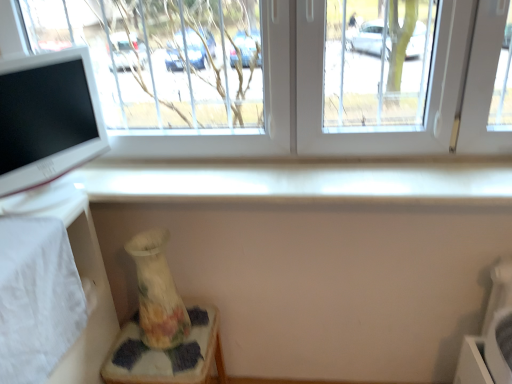
Question: Should I look upward or downward to see white glossy computer monitor at left?

Choices:
 (A) down
 (B) up

Answer: (B)

Question: Is white glossy computer monitor at left completely or partially inside white fabric table at lower left?

Choices:
 (A) yes
 (B) no

Answer: (B)

Question: Considering the relative sizes of white fabric table at lower left and white glossy computer monitor at left in the image provided, is white fabric table at lower left bigger than white glossy computer monitor at left?

Choices:
 (A) yes
 (B) no

Answer: (A)

Question: From a real-world perspective, is white fabric table at lower left over white glossy computer monitor at left?

Choices:
 (A) yes
 (B) no

Answer: (B)

Question: Is white fabric table at lower left to the left of white glossy computer monitor at left from the viewer's perspective?

Choices:
 (A) no
 (B) yes

Answer: (B)

Question: Is white fabric table at lower left thinner than white glossy computer monitor at left?

Choices:
 (A) yes
 (B) no

Answer: (B)

Question: Can you confirm if white fabric table at lower left is shorter than white glossy computer monitor at left?

Choices:
 (A) no
 (B) yes

Answer: (A)

Question: Is porcelain floral vase at lower left shorter than transparent glass window at upper center?

Choices:
 (A) yes
 (B) no

Answer: (A)

Question: Does porcelain floral vase at lower left have a larger size compared to transparent glass window at upper center?

Choices:
 (A) yes
 (B) no

Answer: (B)

Question: From the image's perspective, does porcelain floral vase at lower left appear lower than transparent glass window at upper center?

Choices:
 (A) yes
 (B) no

Answer: (A)

Question: Can you confirm if porcelain floral vase at lower left is wider than transparent glass window at upper center?

Choices:
 (A) yes
 (B) no

Answer: (A)

Question: Does porcelain floral vase at lower left turn towards transparent glass window at upper center?

Choices:
 (A) no
 (B) yes

Answer: (A)

Question: Are porcelain floral vase at lower left and transparent glass window at upper center beside each other?

Choices:
 (A) no
 (B) yes

Answer: (A)

Question: Can you confirm if white glossy computer monitor at left is thinner than white fabric table at lower left?

Choices:
 (A) yes
 (B) no

Answer: (A)